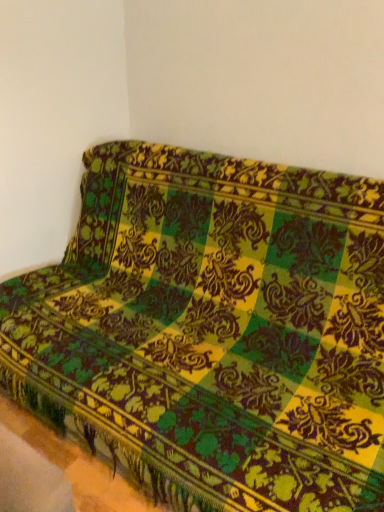
What is the approximate width of velvet green-yellow couch at upper right?

1.13 meters.

Where is `velvet green-yellow couch at upper right`? velvet green-yellow couch at upper right is located at coordinates (213, 331).

What do you see at coordinates (213, 331) in the screenshot? I see `velvet green-yellow couch at upper right` at bounding box center [213, 331].

Locate an element on the screen. velvet green-yellow couch at upper right is located at coordinates (213, 331).